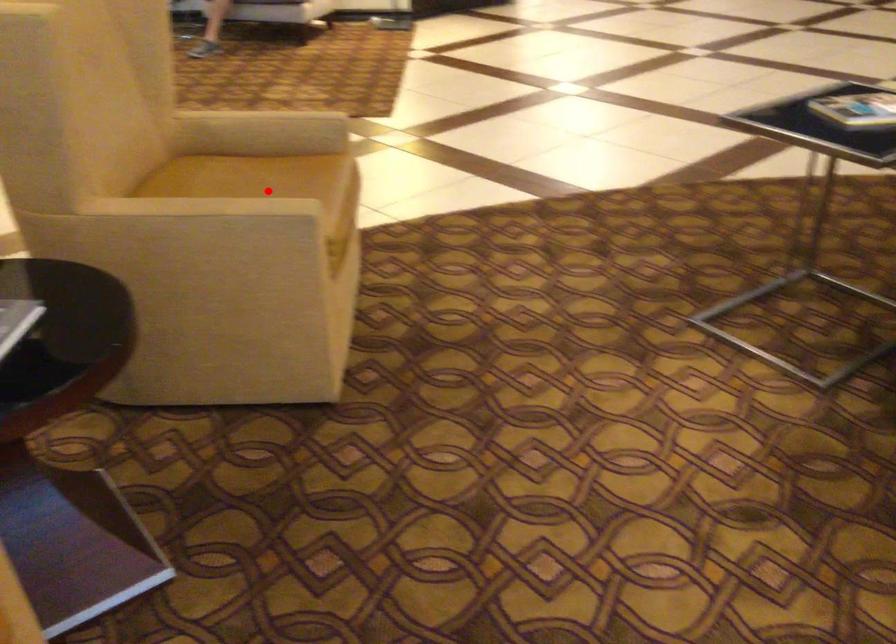
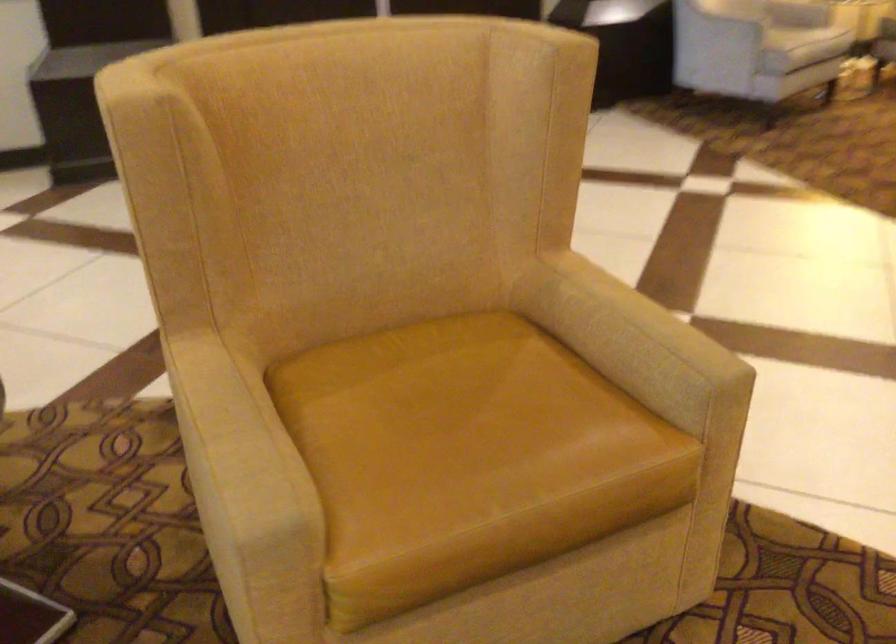
The point at the highlighted location is marked in the first image. Where is the corresponding point in the second image?

(452, 426)